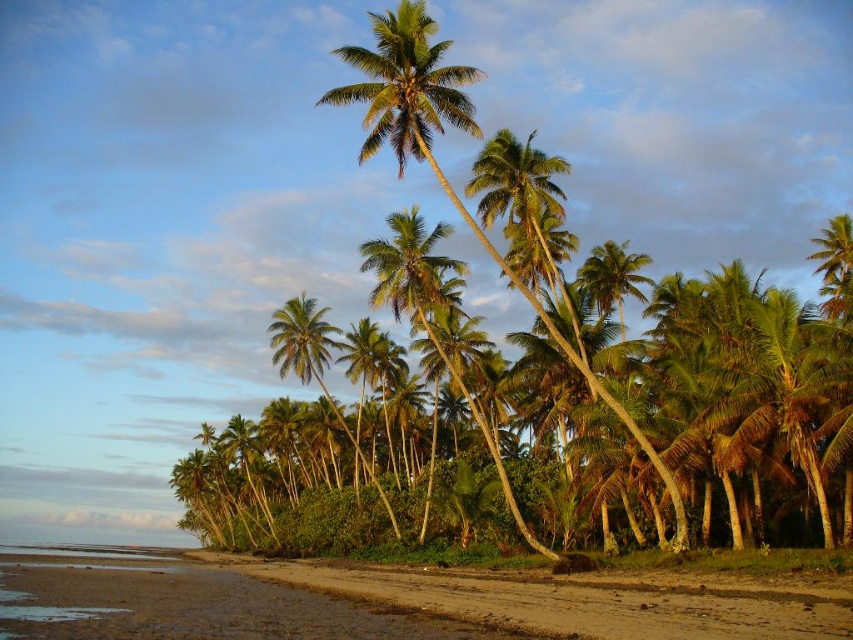
You are standing on the beach and want to take a photo of the green leafy coconut tree at center. If you move 0.1 units to the right along the x axis, will the tree still be in the center of your camera frame?

The green leafy coconut tree at center is located at point (616, 291). Moving 0.1 units to the right along the x axis would shift its position to (616, 355). Since the center of the frame is at (426, 320), the tree would now be slightly to the right and above the center point. Therefore, it would not be perfectly centered in the camera frame anymore.

From the picture: You are standing on the brown sandy beach at lower left and want to walk towards the green leafy coconut tree at center. In which direction should you head?

You should head to the right because the green leafy coconut tree at center is to the left of brown sandy beach at lower left, so moving right will take you towards it.

You are a photographer planning to take a wide shot of the beach scene. You want to ensure both the green leafy coconut tree at center and the brown sandy beach at lower left are clearly visible. Based on their sizes, which object should you prioritize positioning closer to the camera to maintain detail?

The green leafy coconut tree at center is bigger than the brown sandy beach at lower left. To maintain detail for both, prioritize positioning the brown sandy beach at lower left closer to the camera since it is smaller and might need more emphasis to be clearly visible in the wide shot.